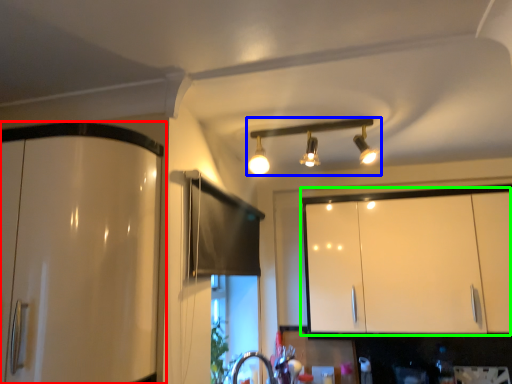
Question: Which is farther away from cabinetry (highlighted by a red box)? lamp (highlighted by a blue box) or cabinetry (highlighted by a green box)?

Choices:
 (A) lamp
 (B) cabinetry

Answer: (B)